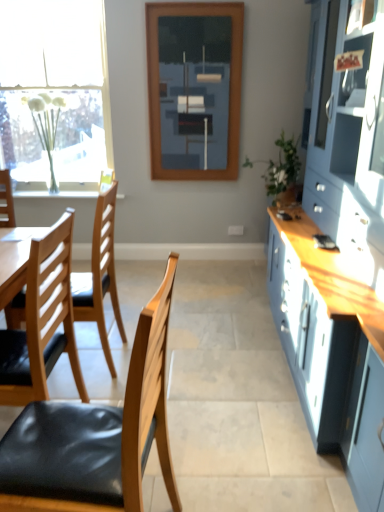
Question: From a real-world perspective, does white frosted glass vase at left stand above wooden chair with black seat cushion at left, the first chair positioned from the back?

Choices:
 (A) no
 (B) yes

Answer: (B)

Question: Is the position of white frosted glass vase at left less distant than that of wooden chair with black seat cushion at left, which appears as the 2th chair when viewed from the front?

Choices:
 (A) yes
 (B) no

Answer: (B)

Question: Is white frosted glass vase at left to the left of wooden chair with black seat cushion at left, the first chair positioned from the back, from the viewer's perspective?

Choices:
 (A) no
 (B) yes

Answer: (B)

Question: Is white frosted glass vase at left to the right of wooden chair with black seat cushion at left, the first chair positioned from the back, from the viewer's perspective?

Choices:
 (A) yes
 (B) no

Answer: (B)

Question: Considering the relative sizes of white frosted glass vase at left and wooden chair with black seat cushion at left, which appears as the 2th chair when viewed from the front, in the image provided, is white frosted glass vase at left shorter than wooden chair with black seat cushion at left, which appears as the 2th chair when viewed from the front,?

Choices:
 (A) no
 (B) yes

Answer: (B)

Question: In terms of width, does white sheer curtain at left look wider or thinner when compared to black glossy mobile phone at right?

Choices:
 (A) wide
 (B) thin

Answer: (A)

Question: From a real-world perspective, is white sheer curtain at left physically located above or below black glossy mobile phone at right?

Choices:
 (A) below
 (B) above

Answer: (B)

Question: Does point (21, 45) appear closer or farther from the camera than point (317, 238)?

Choices:
 (A) farther
 (B) closer

Answer: (A)

Question: Looking at the image, does white sheer curtain at left seem bigger or smaller compared to black glossy mobile phone at right?

Choices:
 (A) small
 (B) big

Answer: (B)

Question: In the image, is matte blue cabinet at right positioned in front of or behind black leather chair at left, the first chair when ordered from front to back?

Choices:
 (A) front
 (B) behind

Answer: (A)

Question: Is point (380, 324) positioned closer to the camera than point (21, 473)?

Choices:
 (A) closer
 (B) farther

Answer: (B)

Question: From a real-world perspective, relative to black leather chair at left, the first chair when ordered from front to back, is matte blue cabinet at right vertically above or below?

Choices:
 (A) below
 (B) above

Answer: (B)

Question: In terms of height, does matte blue cabinet at right look taller or shorter compared to black leather chair at left, the 2th chair when ordered from back to front?

Choices:
 (A) tall
 (B) short

Answer: (A)

Question: Is wooden frame at center in front of or behind matte blue cabinet at right in the image?

Choices:
 (A) front
 (B) behind

Answer: (B)

Question: From a real-world perspective, relative to matte blue cabinet at right, is wooden frame at center vertically above or below?

Choices:
 (A) below
 (B) above

Answer: (B)